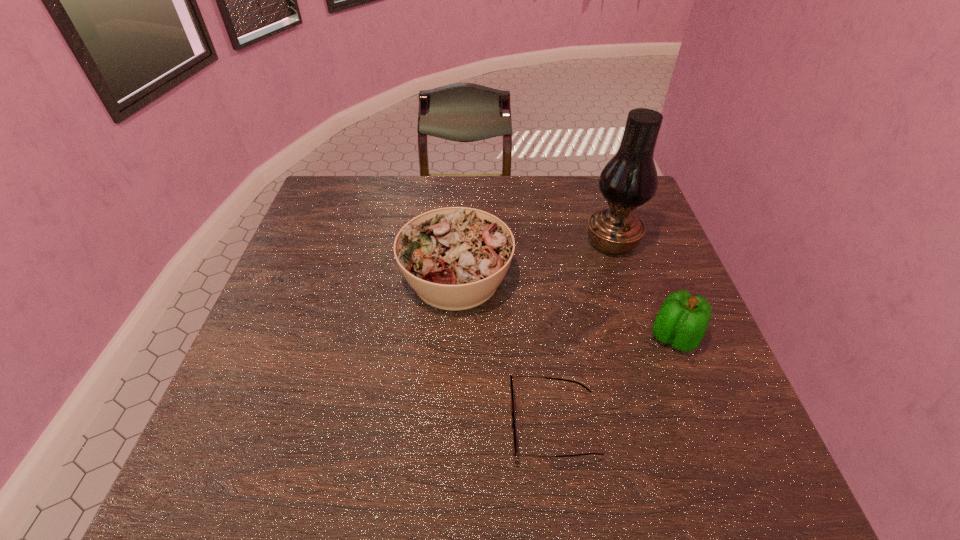
I want to click on oil lamp, so click(629, 179).

Identify the location of salad. (455, 258).

You are a GUI agent. You are given a task and a screenshot of the screen. Output one action in this format:
    pyautogui.click(x=<x>, y=<y>)
    Task: Click on the bell pepper
    The image size is (960, 540).
    Given the screenshot: What is the action you would take?
    pyautogui.click(x=682, y=321)

You are a GUI agent. You are given a task and a screenshot of the screen. Output one action in this format:
    pyautogui.click(x=<x>, y=<y>)
    Task: Click on the spectacles
    
    Given the screenshot: What is the action you would take?
    pyautogui.click(x=514, y=446)

Locate an element on the screen. The image size is (960, 540). the nearest object is located at coordinates (514, 446).

At what (x,y) coordinates should I click in order to perform the action: click on free spot located on the left of the oil lamp. Please return your answer as a coordinate pair (x, y). Image resolution: width=960 pixels, height=540 pixels. Looking at the image, I should click on (553, 242).

Where is `vacant region located 0.100m on the left of the salad`? The image size is (960, 540). vacant region located 0.100m on the left of the salad is located at coordinates (362, 279).

Locate an element on the screen. The width and height of the screenshot is (960, 540). free space located 0.140m on the back of the bell pepper is located at coordinates (651, 277).

At what (x,y) coordinates should I click in order to perform the action: click on vacant area situated 0.380m on the face of the nearest object. Please return your answer as a coordinate pair (x, y). Image resolution: width=960 pixels, height=540 pixels. Looking at the image, I should click on (318, 425).

Locate an element on the screen. The image size is (960, 540). vacant space located on the face of the nearest object is located at coordinates (394, 425).